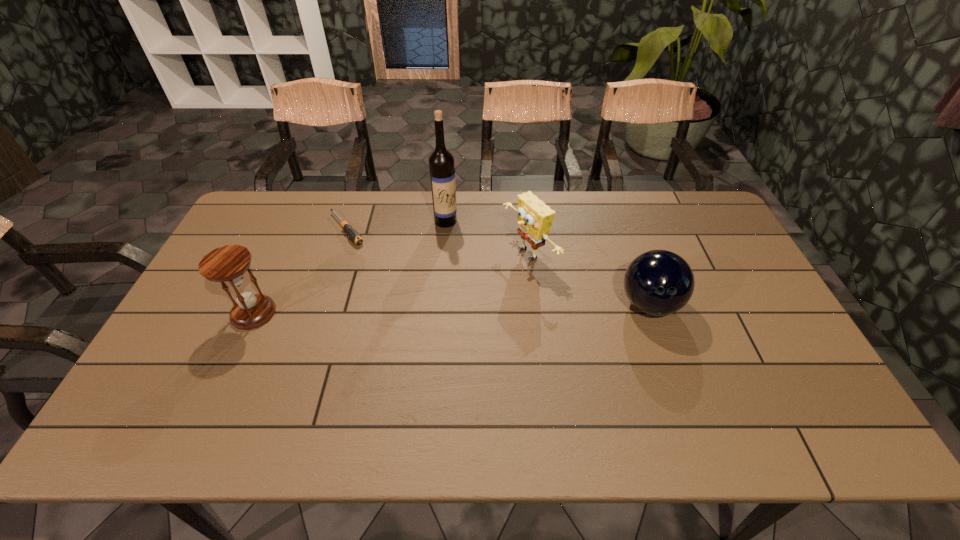
Where is `vacant region between the bowling ball and the third object from right to left`? vacant region between the bowling ball and the third object from right to left is located at coordinates (547, 262).

Find the location of a particular element. The image size is (960, 540). free space that is in between the fourth object from left to right and the hourglass is located at coordinates (392, 284).

Identify the location of vacant area that lies between the leftmost object and the shortest object. The height and width of the screenshot is (540, 960). (300, 271).

At what (x,y) coordinates should I click in order to perform the action: click on free spot between the shortest object and the hourglass. Please return your answer as a coordinate pair (x, y). This screenshot has height=540, width=960. Looking at the image, I should click on (300, 271).

The height and width of the screenshot is (540, 960). I want to click on free spot between the rightmost object and the fourth object from left to right, so click(x=589, y=279).

I want to click on vacant area that lies between the tallest object and the sponge, so click(x=488, y=238).

Locate an element on the screen. free space between the hourglass and the screwdriver is located at coordinates (300, 271).

This screenshot has height=540, width=960. In order to click on vacant area between the leftmost object and the rightmost object in this screenshot , I will do `click(451, 308)`.

Locate an element on the screen. The width and height of the screenshot is (960, 540). unoccupied position between the hourglass and the rightmost object is located at coordinates (451, 308).

You are a GUI agent. You are given a task and a screenshot of the screen. Output one action in this format:
    pyautogui.click(x=<x>, y=<y>)
    Task: Click on the object that is the fourth closest to the rightmost object
    
    Given the screenshot: What is the action you would take?
    pyautogui.click(x=227, y=264)